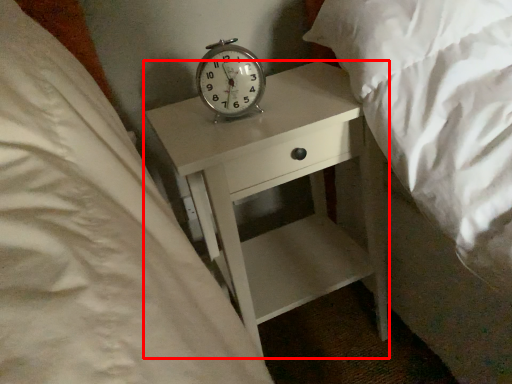
Question: Where is nightstand (annotated by the red box) located in relation to alarm clock in the image?

Choices:
 (A) left
 (B) right

Answer: (B)